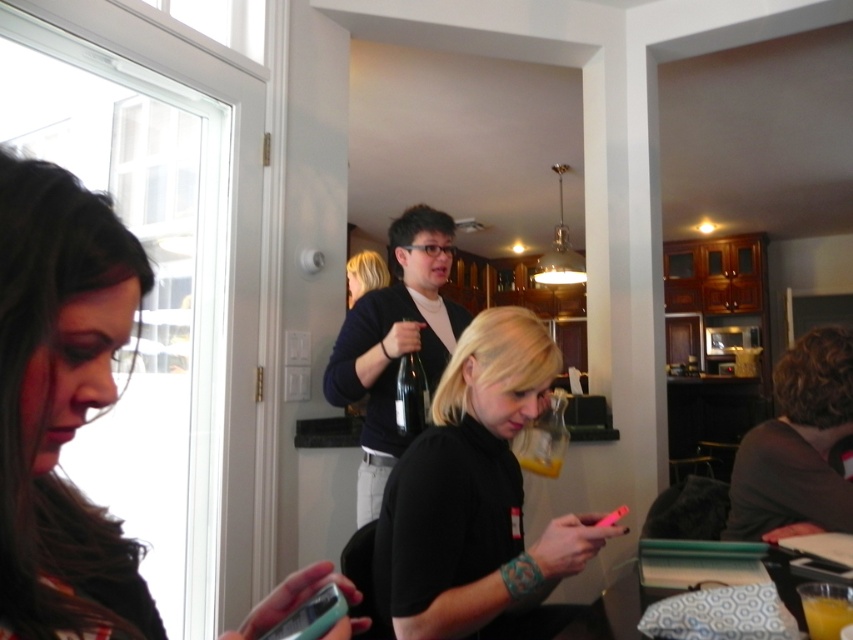
Question: Is black matte shirt at center further to camera compared to orange liquid at lower right?

Choices:
 (A) yes
 (B) no

Answer: (A)

Question: Does black glass bottle at center lie behind orange liquid at lower right?

Choices:
 (A) yes
 (B) no

Answer: (A)

Question: Which point is closer to the camera?

Choices:
 (A) orange liquid at lower right
 (B) dark brown sweater at right

Answer: (A)

Question: Which object is the farthest from the orange liquid at lower right?

Choices:
 (A) black matte shirt at center
 (B) dark brown sweater at right
 (C) black glass bottle at center

Answer: (C)

Question: From the image, what is the correct spatial relationship of matte black phone at left in relation to translucent glass carafe at center?

Choices:
 (A) above
 (B) below

Answer: (A)

Question: Which object is positioned closest to the dark blue sweater at center?

Choices:
 (A) black glass bottle at center
 (B) black matte shirt at center
 (C) orange liquid at lower right
 (D) translucent glass carafe at center

Answer: (A)